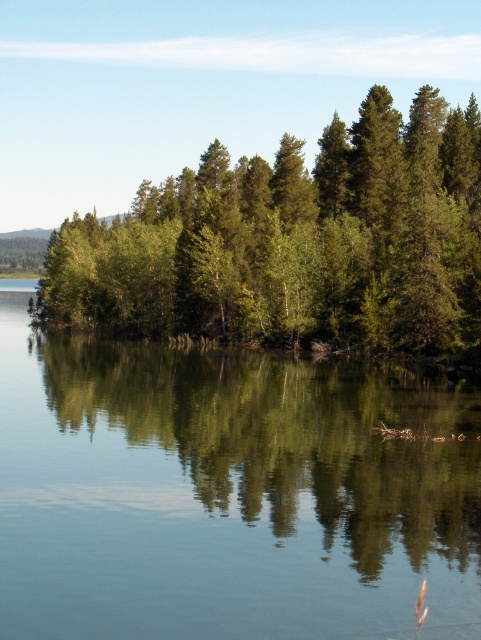
Is green reflective water at center to the right of green matte trees at center from the viewer's perspective?

Yes, green reflective water at center is to the right of green matte trees at center.

In the scene shown: Can you confirm if green reflective water at center is positioned to the left of green matte trees at center?

No, green reflective water at center is not to the left of green matte trees at center.

The width and height of the screenshot is (481, 640). Describe the element at coordinates (228, 492) in the screenshot. I see `green reflective water at center` at that location.

You are a GUI agent. You are given a task and a screenshot of the screen. Output one action in this format:
    pyautogui.click(x=<x>, y=<y>)
    Task: Click on the green reflective water at center
    This screenshot has height=640, width=481.
    Given the screenshot: What is the action you would take?
    pyautogui.click(x=228, y=492)